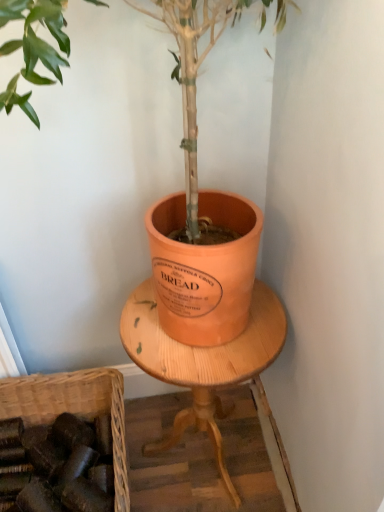
Identify the location of vacant space situated above wooden round table at center (from a real-world perspective). This screenshot has width=384, height=512. (212, 339).